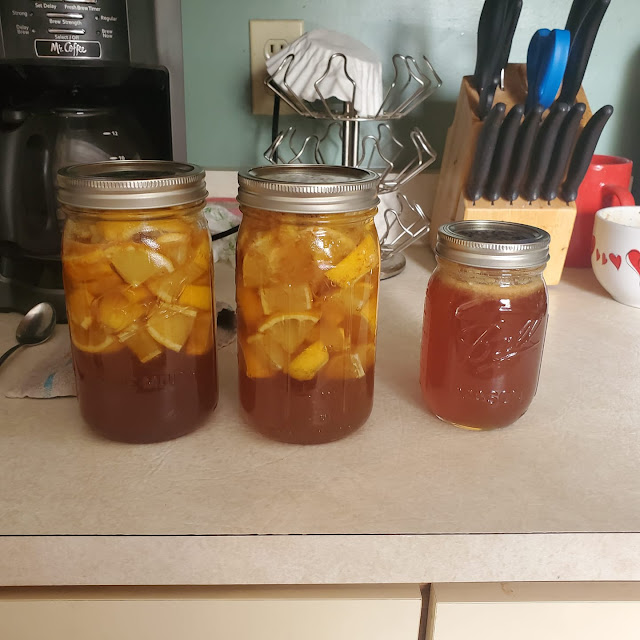
Where is `knives`? Image resolution: width=640 pixels, height=640 pixels. knives is located at coordinates (500, 134).